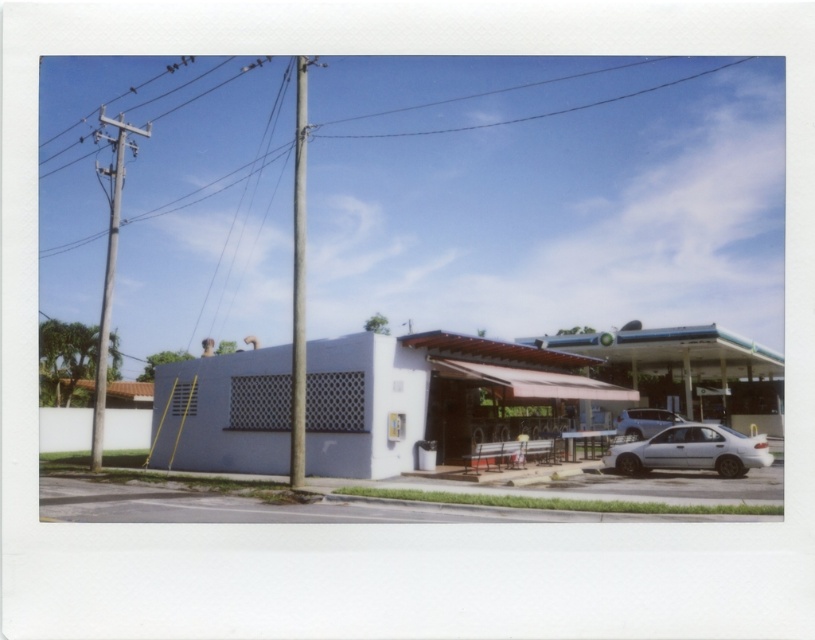
Is metallic gray pole at center below silver metallic car at right?

Actually, metallic gray pole at center is above silver metallic car at right.

Who is positioned more to the right, metallic gray pole at center or silver metallic car at right?

silver metallic car at right

This screenshot has height=640, width=815. What do you see at coordinates (298, 284) in the screenshot?
I see `metallic gray pole at center` at bounding box center [298, 284].

Find the location of a particular element. The width and height of the screenshot is (815, 640). metallic gray pole at center is located at coordinates (298, 284).

Who is positioned more to the right, white matte sedan at lower right or metallic gray pole at center?

From the viewer's perspective, white matte sedan at lower right appears more on the right side.

Between point (652, 440) and point (302, 362), which one is positioned in front?

Point (302, 362) is more forward.

Where is `white matte sedan at lower right`? This screenshot has width=815, height=640. white matte sedan at lower right is located at coordinates (690, 451).

Does point (701, 456) come farther from viewer compared to point (697, 74)?

No, it is in front of (697, 74).

What do you see at coordinates (690, 451) in the screenshot? Image resolution: width=815 pixels, height=640 pixels. I see `white matte sedan at lower right` at bounding box center [690, 451].

Where is `white matte sedan at lower right`? Image resolution: width=815 pixels, height=640 pixels. white matte sedan at lower right is located at coordinates (690, 451).